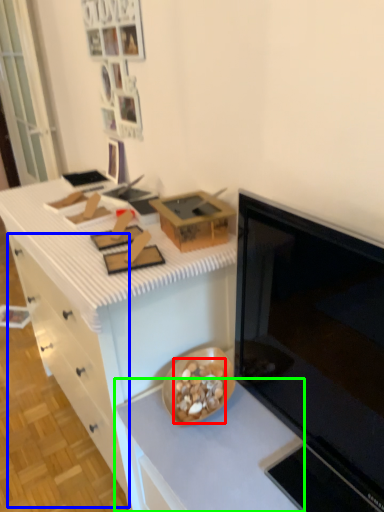
Question: Which object is the closest to the food (highlighted by a red box)? Choose among these: drawer (highlighted by a blue box) or countertop (highlighted by a green box).

Choices:
 (A) drawer
 (B) countertop

Answer: (B)